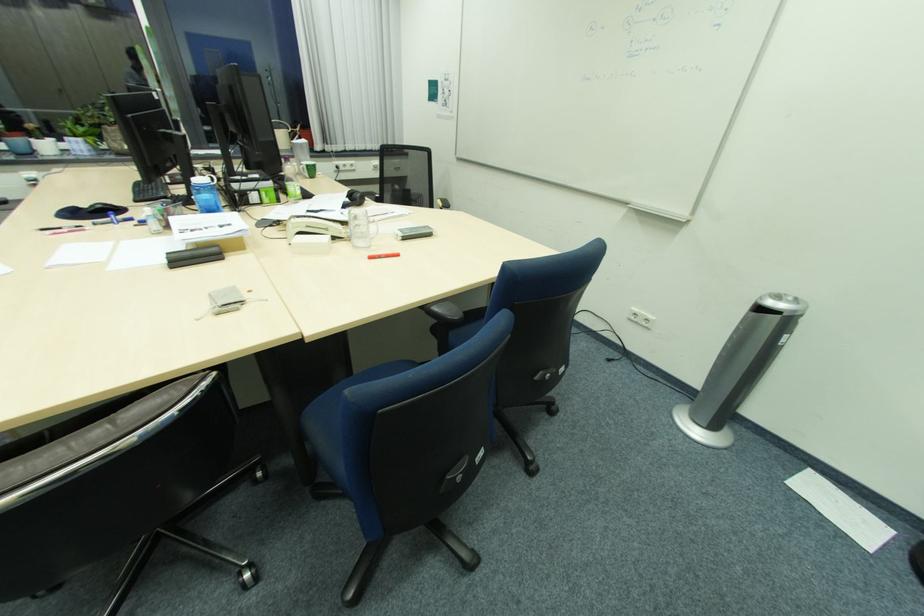
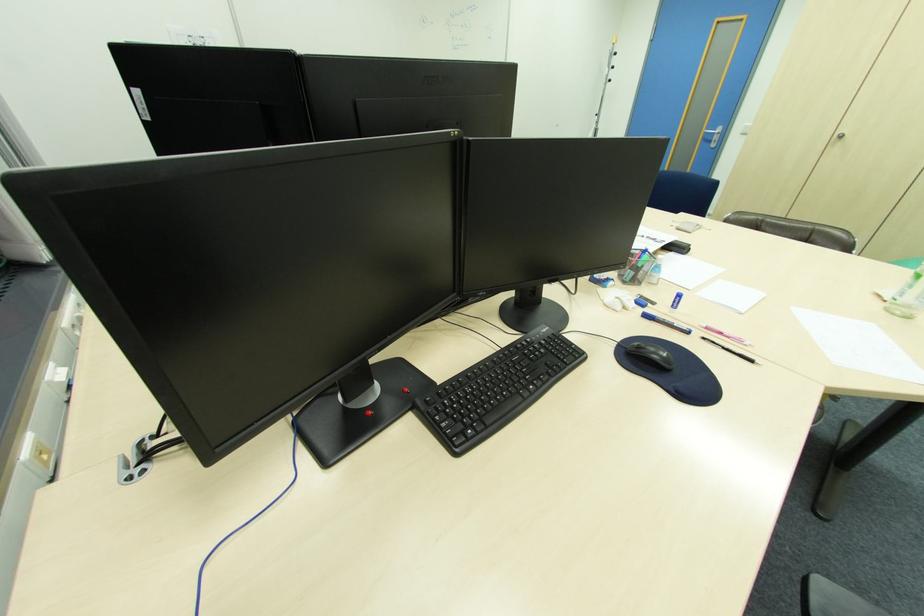
Question: I am providing you with two images of the same scene from different viewpoints. After the viewpoint changes to image2, which objects are now occluded?

Choices:
 (A) pink pen
 (B) black glove
 (C) clear glass mug
 (D) black computer mouse

Answer: (C)